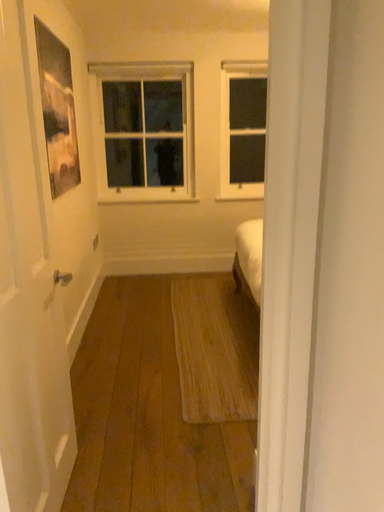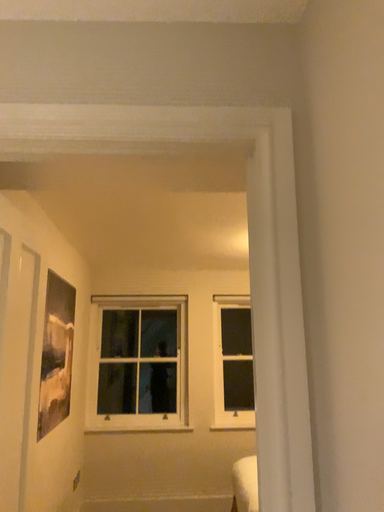
Question: How did the camera likely rotate when shooting the video?

Choices:
 (A) rotated downward
 (B) rotated upward

Answer: (B)